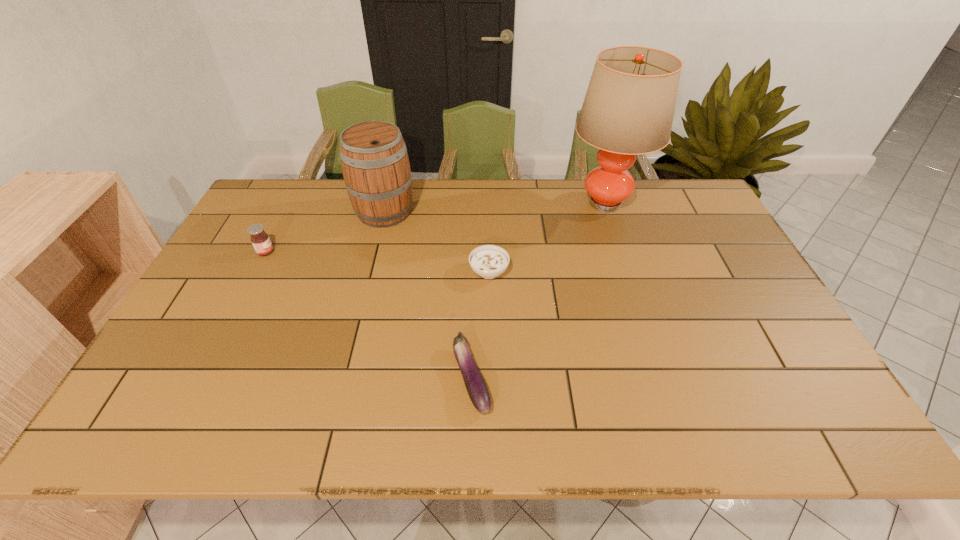
At what (x,y) coordinates should I click in order to perform the action: click on vacant space that satisfies the following two spatial constraints: 1. on the back side of the tallest object; 2. on the right side of the soup bowl. Please return your answer as a coordinate pair (x, y). This screenshot has width=960, height=540. Looking at the image, I should click on (488, 202).